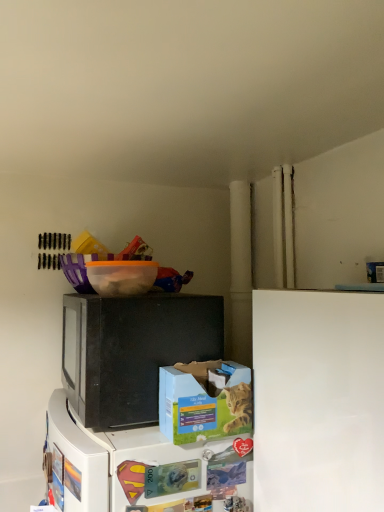
The image size is (384, 512). Identify the location of white matte refrigerator at lower right. (318, 400).

I want to click on black matte microwave at center, so click(132, 351).

Between white matte refrigerator at lower right and black matte microwave at center, which one has less height?

With less height is black matte microwave at center.

Is black matte microwave at center inside white matte refrigerator at lower right?

Actually, black matte microwave at center is outside white matte refrigerator at lower right.

From the image's perspective, which is above, white matte refrigerator at lower right or black matte microwave at center?

From the image's view, black matte microwave at center is above.

Which is more to the right, white matte refrigerator at lower right or black matte microwave at center?

Positioned to the right is white matte refrigerator at lower right.

Between white matte refrigerator at lower right and blue cardboard box at lower center, which one has larger size?

Bigger between the two is white matte refrigerator at lower right.

Which of these two, white matte refrigerator at lower right or blue cardboard box at lower center, stands shorter?

With less height is blue cardboard box at lower center.

Between point (296, 436) and point (164, 426), which one is positioned behind?

Positioned behind is point (164, 426).

Considering the positions of objects white matte refrigerator at lower right and blue cardboard box at lower center in the image provided, who is more to the left, white matte refrigerator at lower right or blue cardboard box at lower center?

From the viewer's perspective, blue cardboard box at lower center appears more on the left side.

In terms of width, does blue cardboard box at lower center look wider or thinner when compared to orange translucent bowl at upper center?

blue cardboard box at lower center is thinner than orange translucent bowl at upper center.

Does blue cardboard box at lower center come behind orange translucent bowl at upper center?

No, it is not.

From the image's perspective, between blue cardboard box at lower center and orange translucent bowl at upper center, who is located below?

blue cardboard box at lower center.

What's the angular difference between orange translucent bowl at upper center and black matte microwave at center's facing directions?

The facing directions of orange translucent bowl at upper center and black matte microwave at center are 0.295 degrees apart.

Is orange translucent bowl at upper center taller than black matte microwave at center?

Incorrect, the height of orange translucent bowl at upper center is not larger of that of black matte microwave at center.

From a real-world perspective, is orange translucent bowl at upper center positioned over black matte microwave at center based on gravity?

Yes, from a real-world perspective, orange translucent bowl at upper center is on top of black matte microwave at center.

Is the surface of orange translucent bowl at upper center in direct contact with black matte microwave at center?

No, orange translucent bowl at upper center is not making contact with black matte microwave at center.

Could you measure the distance between orange translucent bowl at upper center and white matte refrigerator at lower right?

17.99 inches.

From a real-world perspective, between orange translucent bowl at upper center and white matte refrigerator at lower right, who is vertically lower?

white matte refrigerator at lower right, from a real-world perspective.

Considering the positions of objects orange translucent bowl at upper center and white matte refrigerator at lower right in the image provided, who is more to the left, orange translucent bowl at upper center or white matte refrigerator at lower right?

orange translucent bowl at upper center.

From the image's perspective, does black matte microwave at center appear lower than orange translucent bowl at upper center?

Yes, from the image's perspective, black matte microwave at center is below orange translucent bowl at upper center.

Which point is more distant from viewer, [140,352] or [154,266]?

The point [154,266] is more distant.

Considering the relative positions of black matte microwave at center and orange translucent bowl at upper center in the image provided, is black matte microwave at center to the left of orange translucent bowl at upper center from the viewer's perspective?

In fact, black matte microwave at center is to the right of orange translucent bowl at upper center.

The image size is (384, 512). Find the location of `microwave oven below the orange translucent bowl at upper center (from the image's perspective)`. microwave oven below the orange translucent bowl at upper center (from the image's perspective) is located at coordinates (132, 351).

Could you tell me if blue cardboard box at lower center is facing white matte refrigerator at lower right?

No, blue cardboard box at lower center is not facing towards white matte refrigerator at lower right.

Can you confirm if blue cardboard box at lower center is thinner than white matte refrigerator at lower right?

Yes.

Considering the positions of objects blue cardboard box at lower center and white matte refrigerator at lower right in the image provided, who is more to the left, blue cardboard box at lower center or white matte refrigerator at lower right?

blue cardboard box at lower center is more to the left.

Who is smaller, blue cardboard box at lower center or white matte refrigerator at lower right?

Smaller between the two is blue cardboard box at lower center.

The width and height of the screenshot is (384, 512). I want to click on refrigerator below the black matte microwave at center (from a real-world perspective), so click(x=318, y=400).

In the image, there is a blue cardboard box at lower center. Identify the location of refrigerator below it (from the image's perspective). The width and height of the screenshot is (384, 512). (318, 400).

Estimate the real-world distances between objects in this image. Which object is further from black matte microwave at center, white matte refrigerator at lower right or blue cardboard box at lower center?

Based on the image, white matte refrigerator at lower right appears to be further to black matte microwave at center.

Considering their positions, is black matte microwave at center positioned closer to blue cardboard box at lower center than white matte refrigerator at lower right?

Based on the image, black matte microwave at center appears to be nearer to blue cardboard box at lower center.

Which object lies nearer to the anchor point orange translucent bowl at upper center, black matte microwave at center or blue cardboard box at lower center?

black matte microwave at center is positioned closer to the anchor orange translucent bowl at upper center.

From the image, which object appears to be nearer to blue cardboard box at lower center, white matte refrigerator at lower right or orange translucent bowl at upper center?

white matte refrigerator at lower right.

When comparing their distances from black matte microwave at center, does orange translucent bowl at upper center or blue cardboard box at lower center seem further?

orange translucent bowl at upper center.

Considering their positions, is black matte microwave at center positioned further to blue cardboard box at lower center than orange translucent bowl at upper center?

orange translucent bowl at upper center lies further to blue cardboard box at lower center than the other object.

When comparing their distances from white matte refrigerator at lower right, does black matte microwave at center or blue cardboard box at lower center seem closer?

Based on the image, blue cardboard box at lower center appears to be nearer to white matte refrigerator at lower right.

From the image, which object appears to be nearer to orange translucent bowl at upper center, blue cardboard box at lower center or black matte microwave at center?

The object closer to orange translucent bowl at upper center is black matte microwave at center.

You are a GUI agent. You are given a task and a screenshot of the screen. Output one action in this format:
    pyautogui.click(x=<x>, y=<y>)
    Task: Click on the box between black matte microwave at center and white matte refrigerator at lower right
    Image resolution: width=384 pixels, height=512 pixels.
    Given the screenshot: What is the action you would take?
    pyautogui.click(x=204, y=401)

At what (x,y) coordinates should I click in order to perform the action: click on microwave oven situated between orange translucent bowl at upper center and white matte refrigerator at lower right from left to right. Please return your answer as a coordinate pair (x, y). Looking at the image, I should click on (132, 351).

You are a GUI agent. You are given a task and a screenshot of the screen. Output one action in this format:
    pyautogui.click(x=<x>, y=<y>)
    Task: Click on the box between orange translucent bowl at upper center and white matte refrigerator at lower right
    The height and width of the screenshot is (512, 384).
    Given the screenshot: What is the action you would take?
    pyautogui.click(x=204, y=401)

Locate an element on the screen. The image size is (384, 512). microwave oven between orange translucent bowl at upper center and blue cardboard box at lower center from top to bottom is located at coordinates (132, 351).